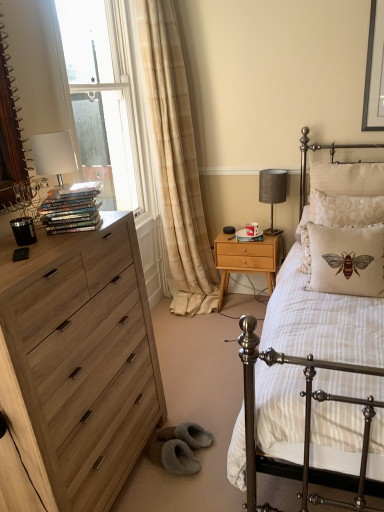
Question: Should I look upward or downward to see beige fabric curtain at left?

Choices:
 (A) down
 (B) up

Answer: (B)

Question: Would you say shiny metallic books at left is part of beige embroidered pillow at right, the 1th pillow in the front-to-back sequence,'s contents?

Choices:
 (A) no
 (B) yes

Answer: (A)

Question: Does beige embroidered pillow at right, the 1th pillow in the front-to-back sequence, have a larger size compared to shiny metallic books at left?

Choices:
 (A) no
 (B) yes

Answer: (B)

Question: Can you confirm if beige embroidered pillow at right, which is counted as the 3th pillow, starting from the back, is wider than shiny metallic books at left?

Choices:
 (A) yes
 (B) no

Answer: (A)

Question: Is beige embroidered pillow at right, which is counted as the 3th pillow, starting from the back, to the left of shiny metallic books at left from the viewer's perspective?

Choices:
 (A) yes
 (B) no

Answer: (B)

Question: Does beige embroidered pillow at right, the 1th pillow in the front-to-back sequence, lie behind shiny metallic books at left?

Choices:
 (A) yes
 (B) no

Answer: (A)

Question: Is white striped fabric at center further to the viewer compared to beige damask pillow at right, marked as the second pillow in a back-to-front arrangement?

Choices:
 (A) no
 (B) yes

Answer: (A)

Question: From a real-world perspective, does white striped fabric at center sit lower than beige damask pillow at right, positioned as the second pillow in front-to-back order?

Choices:
 (A) yes
 (B) no

Answer: (A)

Question: Is the position of white striped fabric at center less distant than that of beige damask pillow at right, marked as the second pillow in a back-to-front arrangement?

Choices:
 (A) no
 (B) yes

Answer: (B)

Question: Could beige damask pillow at right, positioned as the second pillow in front-to-back order, be considered to be inside white striped fabric at center?

Choices:
 (A) yes
 (B) no

Answer: (A)

Question: Considering the relative sizes of white striped fabric at center and beige damask pillow at right, marked as the second pillow in a back-to-front arrangement, in the image provided, is white striped fabric at center wider than beige damask pillow at right, marked as the second pillow in a back-to-front arrangement,?

Choices:
 (A) no
 (B) yes

Answer: (B)

Question: Can we say white striped fabric at center lies outside beige damask pillow at right, marked as the second pillow in a back-to-front arrangement?

Choices:
 (A) yes
 (B) no

Answer: (A)

Question: Can you confirm if white striped fabric at center is wider than beige fabric curtain at left?

Choices:
 (A) yes
 (B) no

Answer: (A)